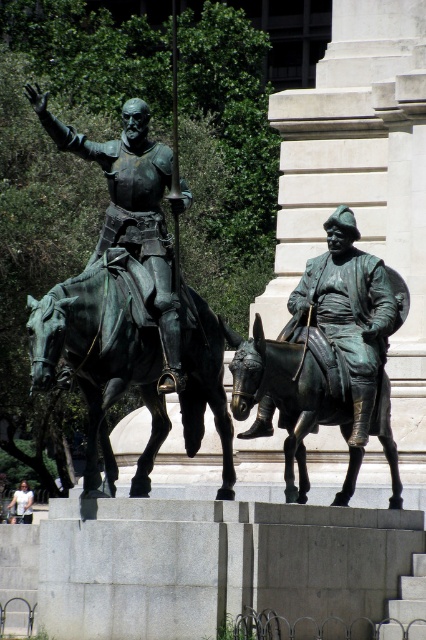
You are standing in front of the bronze statue of horse at left and the white cotton shirt at lower left. Which object is positioned to the right of the other?

The bronze statue of horse at left is to the right of the white cotton shirt at lower left.

You are an artist planning to paint the scene. You need to decide which object to focus on first based on their sizes. Which object should you paint first, the bronze statue of donkey at center or the white cotton shirt at lower left?

The bronze statue of donkey at center has a larger size compared to the white cotton shirt at lower left, so you should paint the bronze statue of donkey at center first as it is the larger object in the scene.

Looking at this image, you are an art student standing in front of the bronze statue of donkey at center and the white cotton shirt at lower left. You need to sketch both objects but want to ensure you capture their positions correctly. Which object should you sketch first to maintain the correct spatial relationship as seen from your viewpoint?

You should sketch the white cotton shirt at lower left first because the bronze statue of donkey at center is to the right of it, meaning the shirt is on the left side and closer to your starting point.